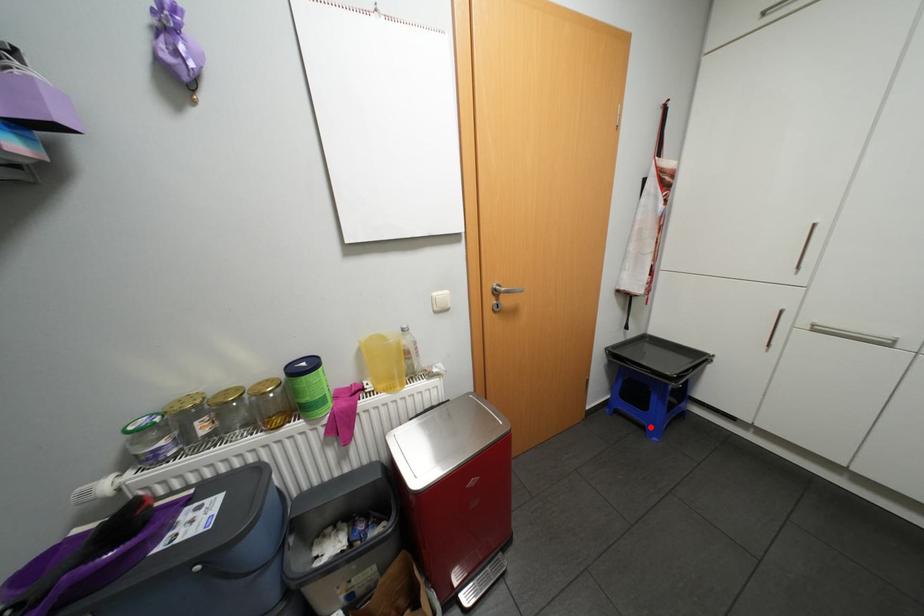
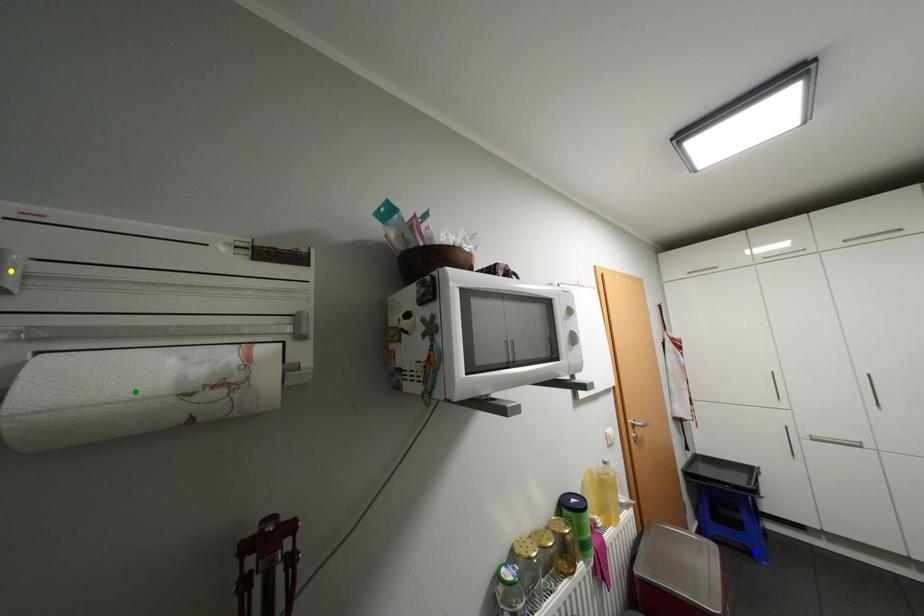
Question: I am providing you with two images of the same scene from different viewpoints. A red point is marked on the first image. You are given multiple points on the second image. Can you choose the point in image 2 that corresponds to the point in image 1?

Choices:
 (A) green point
 (B) yellow point
 (C) blue point

Answer: (C)